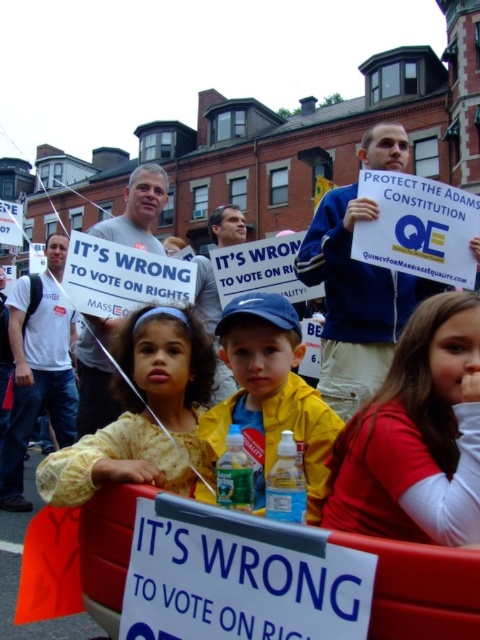
From the picture: You are a photographer at this rally and want to capture a photo that includes both the red cotton shirt at lower right and the yellow fabric jacket at center. Based on their positions, which one should you focus on first to ensure both are in the frame?

The red cotton shirt at lower right is in front of the yellow fabric jacket at center, so you should focus on the yellow fabric jacket at center first to ensure both are visible in the frame.